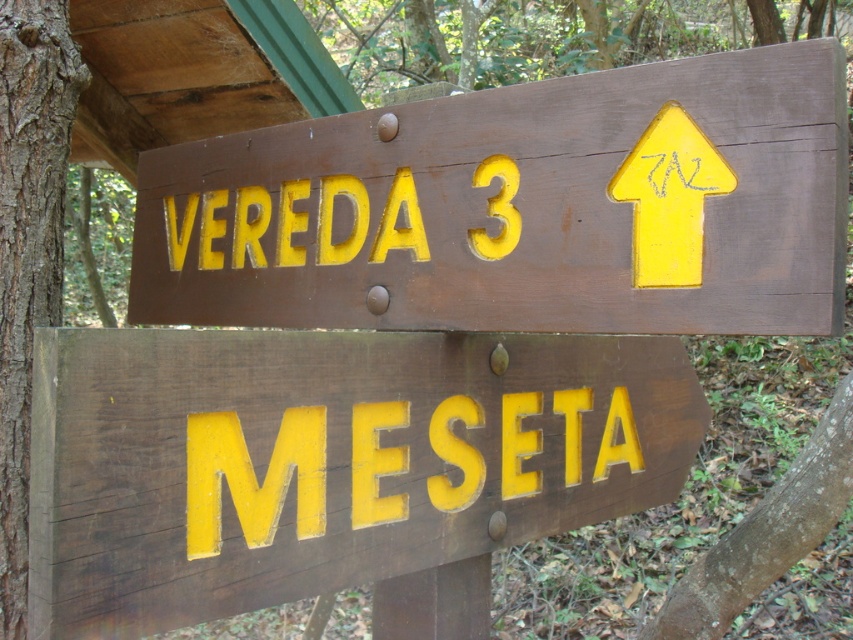
Question: Among these points, which one is nearest to the camera?

Choices:
 (A) (148, 300)
 (B) (279, 579)
 (C) (22, 237)

Answer: (B)

Question: Does matte brown sign at upper center appear under brown rough bark at left?

Choices:
 (A) no
 (B) yes

Answer: (A)

Question: Observing the image, what is the correct spatial positioning of matte brown sign at upper center in reference to brown rough bark at left?

Choices:
 (A) left
 (B) right

Answer: (B)

Question: Which object appears farthest from the camera in this image?

Choices:
 (A) brown rough bark at left
 (B) matte wood sign at center
 (C) matte brown sign at upper center

Answer: (A)

Question: Considering the real-world distances, which object is closest to the brown rough bark at left?

Choices:
 (A) matte brown sign at upper center
 (B) matte wood sign at center

Answer: (A)

Question: Observing the image, what is the correct spatial positioning of matte wood sign at center in reference to brown rough bark at left?

Choices:
 (A) below
 (B) above

Answer: (A)